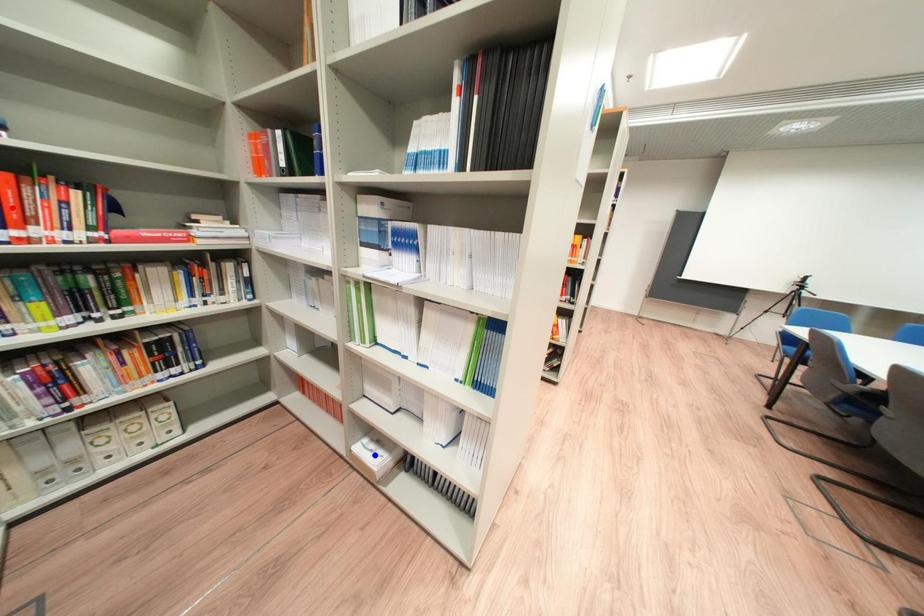
Question: In the image, two points are highlighted. Which point is nearer to the camera? Reply with the corresponding letter.

Choices:
 (A) blue point
 (B) red point

Answer: (B)